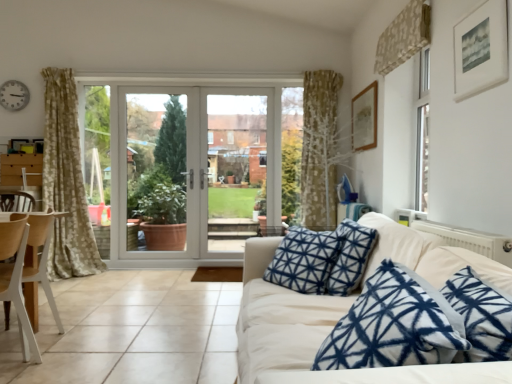
Find the location of `vacant space underneath white wood chair at lower left (from a real-world perspective)`. vacant space underneath white wood chair at lower left (from a real-world perspective) is located at coordinates (10, 370).